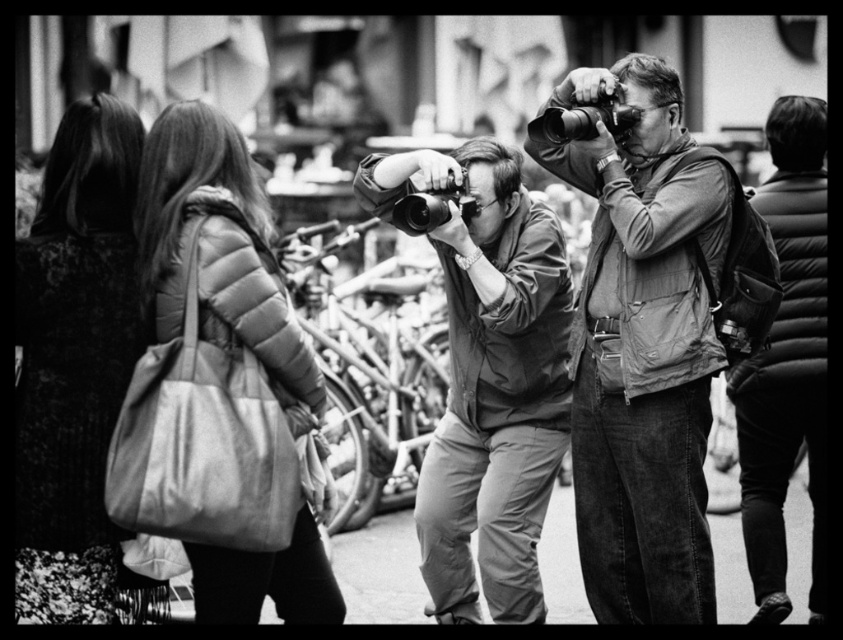
Which is in front, point (632, 273) or point (94, 538)?

Point (94, 538) is in front.

Locate an element on the screen. The height and width of the screenshot is (640, 843). matte gray vest at center is located at coordinates (642, 349).

Is leather handbag at left below matte puffer jacket at left?

No, leather handbag at left is not below matte puffer jacket at left.

Is leather handbag at left smaller than matte puffer jacket at left?

Indeed, leather handbag at left has a smaller size compared to matte puffer jacket at left.

Who is more forward, [55,620] or [203,572]?

Point [55,620] is in front.

Identify the location of leather handbag at left. (74, 362).

This screenshot has height=640, width=843. What do you see at coordinates (489, 380) in the screenshot? I see `matte black camera at center` at bounding box center [489, 380].

Is point (396, 163) in front of point (40, 193)?

That is True.

Identify the location of matte black camera at center. Image resolution: width=843 pixels, height=640 pixels. (489, 380).